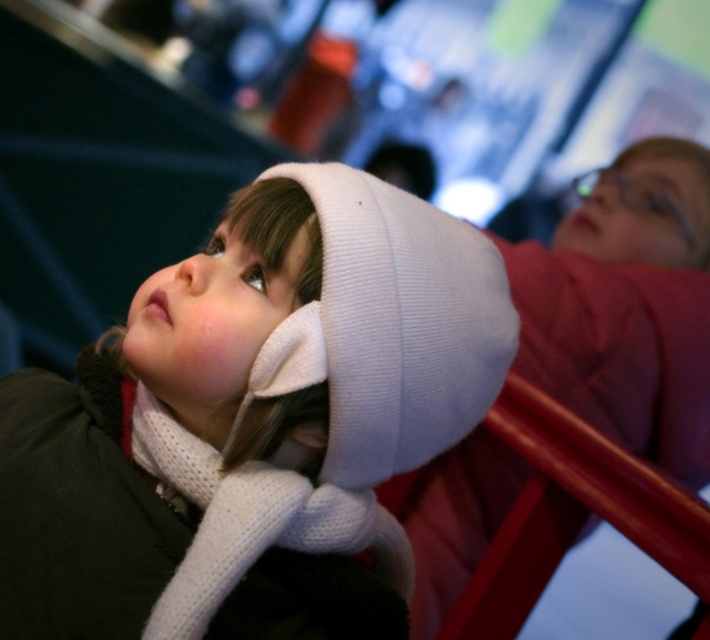
You are a fashion designer trying to create a matching winter outfit. Given the white knitted hat at upper left and the white knitted scarf at lower left, which item should you choose as the base for the outfit if you want the wider item to set the theme?

The white knitted hat at upper left should be chosen as the base since its width is larger than the white knitted scarf at lower left, making it the wider item to set the theme.